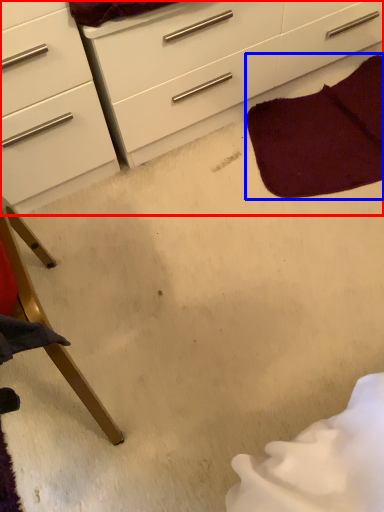
Question: Among these objects, which one is farthest to the camera, chest of drawers (highlighted by a red box) or blanket (highlighted by a blue box)?

Choices:
 (A) chest of drawers
 (B) blanket

Answer: (B)